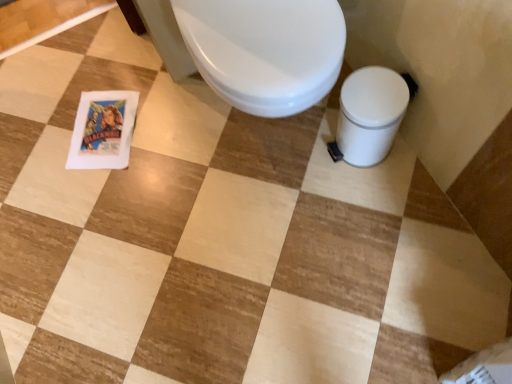
Where is `white glossy toilet bowl at lower right`? white glossy toilet bowl at lower right is located at coordinates (370, 114).

Measure the distance between white glossy toilet bowl at lower right and camera.

They are 1.08 meters apart.

Image resolution: width=512 pixels, height=384 pixels. Describe the element at coordinates (370, 114) in the screenshot. I see `white glossy toilet bowl at lower right` at that location.

The width and height of the screenshot is (512, 384). What are the coordinates of `white glossy toilet bowl at lower right` in the screenshot? It's located at (370, 114).